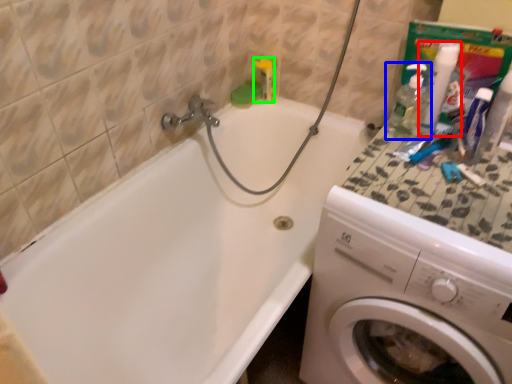
Question: Which object is the farthest from cleaning product (highlighted by a red box)? Choose among these: cleaning product (highlighted by a blue box) or toiletry (highlighted by a green box).

Choices:
 (A) cleaning product
 (B) toiletry

Answer: (B)